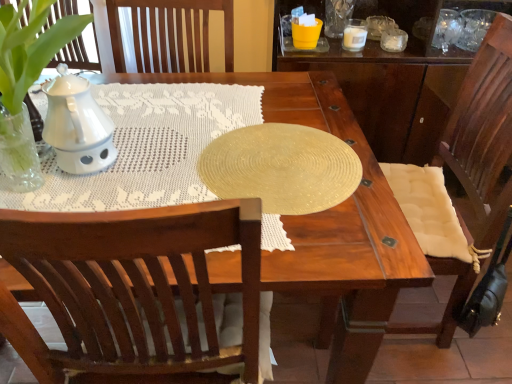
The image size is (512, 384). Identify the location of white ceramic candle at upper right. (354, 35).

Describe the element at coordinates (483, 130) in the screenshot. I see `white textured cushion at right` at that location.

Identify the location of white ceramic candle at upper right. (354, 35).

Is shiny gold placemat at center aimed at white ceramic candle at upper right?

No, shiny gold placemat at center is not aimed at white ceramic candle at upper right.

What's the angular difference between shiny gold placemat at center and white ceramic candle at upper right's facing directions?

They differ by 85.1 degrees in their facing directions.

Which of these two, shiny gold placemat at center or white ceramic candle at upper right, is bigger?

shiny gold placemat at center.

From the image's perspective, is shiny gold placemat at center located above or below white ceramic candle at upper right?

From the image's perspective, shiny gold placemat at center appears below white ceramic candle at upper right.

Does shiny gold placemat at center have a lesser height compared to white textured cushion at right?

Yes.

Which is farther, (269,135) or (443,152)?

Positioned behind is point (443,152).

Find the location of `chair below the shiny gold placemat at center (from the image's perspective)`. chair below the shiny gold placemat at center (from the image's perspective) is located at coordinates (483, 130).

Which of these two, white ceramic candle at upper right or white textured cushion at right, is bigger?

white textured cushion at right is bigger.

Would you consider white ceramic candle at upper right to be distant from white textured cushion at right?

That's not correct — white ceramic candle at upper right is a little close to white textured cushion at right.

Measure the distance between white ceramic candle at upper right and white textured cushion at right.

They are 29.04 inches apart.

Can you tell me how much white ceramic candle at upper right and white textured cushion at right differ in facing direction?

The facing directions of white ceramic candle at upper right and white textured cushion at right are 89 degrees apart.

From a real-world perspective, is white textured cushion at right positioned under white ceramic candle at upper right based on gravity?

Yes, from a real-world perspective, white textured cushion at right is under white ceramic candle at upper right.

Looking at this image, is white textured cushion at right oriented towards white ceramic candle at upper right?

No, white textured cushion at right is not turned towards white ceramic candle at upper right.

Is white textured cushion at right positioned in front of white ceramic candle at upper right?

Yes, it is.

In terms of size, does white ceramic candle at upper right appear bigger or smaller than shiny gold placemat at center?

Considering their sizes, white ceramic candle at upper right takes up less space than shiny gold placemat at center.

Is white ceramic candle at upper right facing towards shiny gold placemat at center?

Yes, white ceramic candle at upper right is oriented towards shiny gold placemat at center.

From the image's perspective, which is above, white ceramic candle at upper right or shiny gold placemat at center?

From the image's view, white ceramic candle at upper right is above.

Which of these two, white ceramic candle at upper right or shiny gold placemat at center, is wider?

shiny gold placemat at center is wider.

In the scene shown: Is there a large distance between white textured cushion at right and shiny gold placemat at center?

That's not correct — white textured cushion at right is a little close to shiny gold placemat at center.

Which of these two, white textured cushion at right or shiny gold placemat at center, stands shorter?

shiny gold placemat at center is shorter.

From the image's perspective, between white textured cushion at right and shiny gold placemat at center, which one is located above?

shiny gold placemat at center.

This screenshot has height=384, width=512. In order to click on candle holder behind the shiny gold placemat at center in this screenshot , I will do `click(354, 35)`.

The height and width of the screenshot is (384, 512). What are the coordinates of `chair located in front of the shiny gold placemat at center` in the screenshot? It's located at (483, 130).

Which object lies nearer to the anchor point white ceramic candle at upper right, white textured cushion at right or shiny gold placemat at center?

The object closer to white ceramic candle at upper right is white textured cushion at right.

Looking at the image, which one is located closer to white ceramic candle at upper right, shiny gold placemat at center or white textured cushion at right?

white textured cushion at right is positioned closer to the anchor white ceramic candle at upper right.

Estimate the real-world distances between objects in this image. Which object is closer to shiny gold placemat at center, white textured cushion at right or white ceramic candle at upper right?

white textured cushion at right is closer to shiny gold placemat at center.

Considering their positions, is shiny gold placemat at center positioned closer to white textured cushion at right than white ceramic candle at upper right?

shiny gold placemat at center is positioned closer to the anchor white textured cushion at right.

Estimate the real-world distances between objects in this image. Which object is closer to shiny gold placemat at center, white ceramic candle at upper right or white textured cushion at right?

white textured cushion at right is positioned closer to the anchor shiny gold placemat at center.

From the image, which object appears to be farther from white textured cushion at right, white ceramic candle at upper right or shiny gold placemat at center?

white ceramic candle at upper right.

In order to click on oval between white textured cushion at right and white ceramic candle at upper right from front to back in this screenshot , I will do `click(281, 168)`.